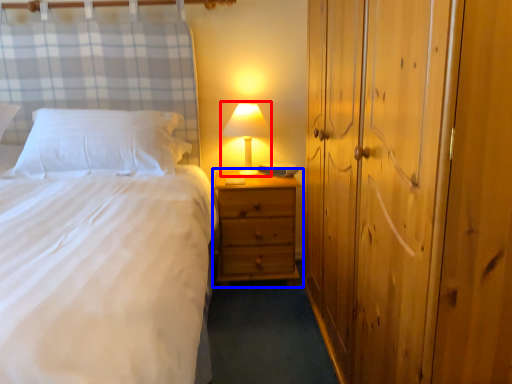
Question: Which object appears farthest to the camera in this image, table lamp (highlighted by a red box) or nightstand (highlighted by a blue box)?

Choices:
 (A) table lamp
 (B) nightstand

Answer: (A)